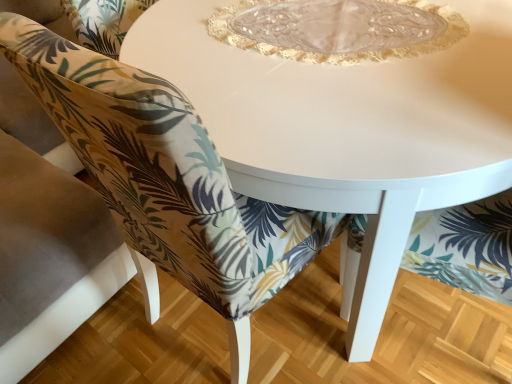
Question: Are printed fabric chair at center and white glossy table at center located far from each other?

Choices:
 (A) yes
 (B) no

Answer: (B)

Question: Is printed fabric chair at center outside white glossy table at center?

Choices:
 (A) no
 (B) yes

Answer: (B)

Question: Can you confirm if printed fabric chair at center is wider than white glossy table at center?

Choices:
 (A) yes
 (B) no

Answer: (A)

Question: Is printed fabric chair at center bigger than white glossy table at center?

Choices:
 (A) no
 (B) yes

Answer: (B)

Question: Does printed fabric chair at center touch white glossy table at center?

Choices:
 (A) yes
 (B) no

Answer: (B)

Question: Choose the correct answer: Is transparent glass plate at center inside printed fabric chair at center or outside it?

Choices:
 (A) outside
 (B) inside

Answer: (A)

Question: Looking at their shapes, would you say transparent glass plate at center is wider or thinner than printed fabric chair at center?

Choices:
 (A) wide
 (B) thin

Answer: (B)

Question: Considering the positions of point (321, 3) and point (261, 230), is point (321, 3) closer or farther from the camera than point (261, 230)?

Choices:
 (A) closer
 (B) farther

Answer: (B)

Question: Is transparent glass plate at center in front of or behind printed fabric chair at center in the image?

Choices:
 (A) behind
 (B) front

Answer: (A)

Question: Looking at the image, does printed fabric chair at center seem bigger or smaller compared to white glossy table at center?

Choices:
 (A) big
 (B) small

Answer: (A)

Question: Looking at their shapes, would you say printed fabric chair at center is wider or thinner than white glossy table at center?

Choices:
 (A) thin
 (B) wide

Answer: (B)

Question: Is printed fabric chair at center spatially inside white glossy table at center, or outside of it?

Choices:
 (A) inside
 (B) outside

Answer: (B)

Question: From their relative heights in the image, would you say printed fabric chair at center is taller or shorter than white glossy table at center?

Choices:
 (A) short
 (B) tall

Answer: (B)

Question: From the image's perspective, is printed fabric chair at center located above or below transparent glass plate at center?

Choices:
 (A) above
 (B) below

Answer: (A)

Question: Relative to transparent glass plate at center, is printed fabric chair at center in front or behind?

Choices:
 (A) front
 (B) behind

Answer: (A)